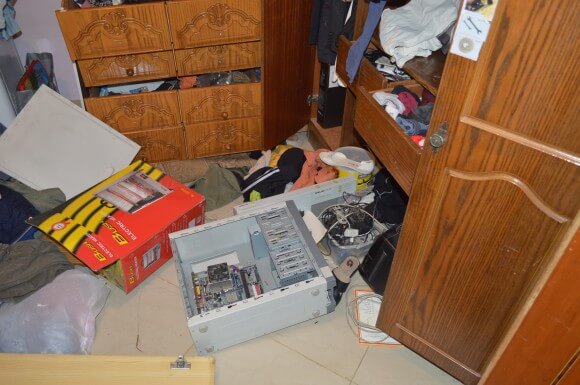
The width and height of the screenshot is (580, 385). I want to click on gray wall, so click(x=42, y=29).